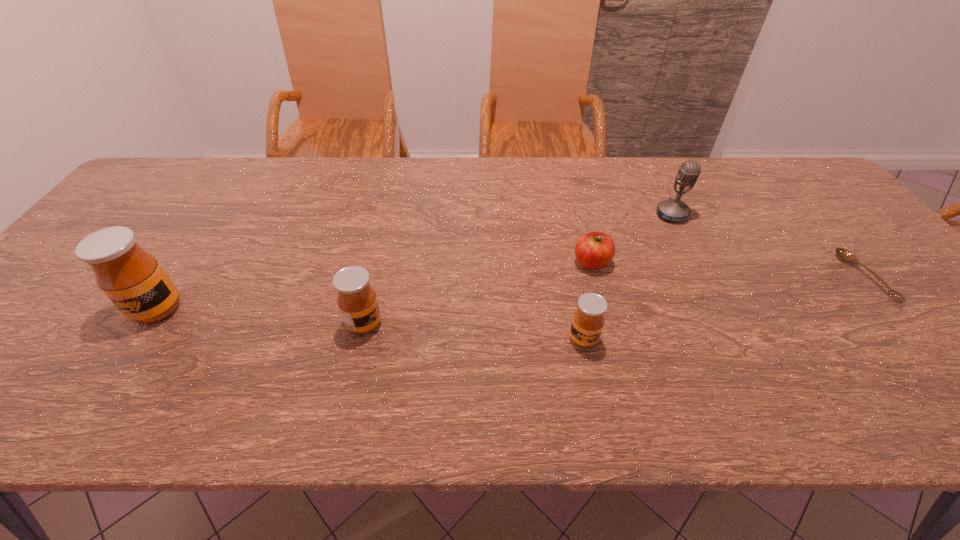
At what (x,y) coordinates should I click in order to perform the action: click on vacant area at the near edge. Please return your answer as a coordinate pair (x, y). Image resolution: width=960 pixels, height=540 pixels. Looking at the image, I should click on (741, 357).

This screenshot has width=960, height=540. Identify the location of free region at the left edge of the desktop. (69, 313).

The image size is (960, 540). Identify the location of free space at the right edge of the desktop. (886, 264).

In the image, there is a desktop. Identify the location of blank space at the near left corner. (3, 360).

In the image, there is a desktop. Identify the location of vacant area at the far right corner. (820, 197).

The width and height of the screenshot is (960, 540). I want to click on vacant area between the ladle and the second honey from left to right, so click(x=614, y=301).

Locate an element on the screen. Image resolution: width=960 pixels, height=540 pixels. vacant space that's between the farthest object and the rightmost object is located at coordinates (768, 246).

Locate an element on the screen. free space between the fifth tallest object and the tallest honey is located at coordinates (374, 286).

Find the location of `free spot between the rightmost honey and the fifth object from right to left`. free spot between the rightmost honey and the fifth object from right to left is located at coordinates (474, 332).

The image size is (960, 540). I want to click on empty space between the shortest object and the leftmost object, so click(x=511, y=293).